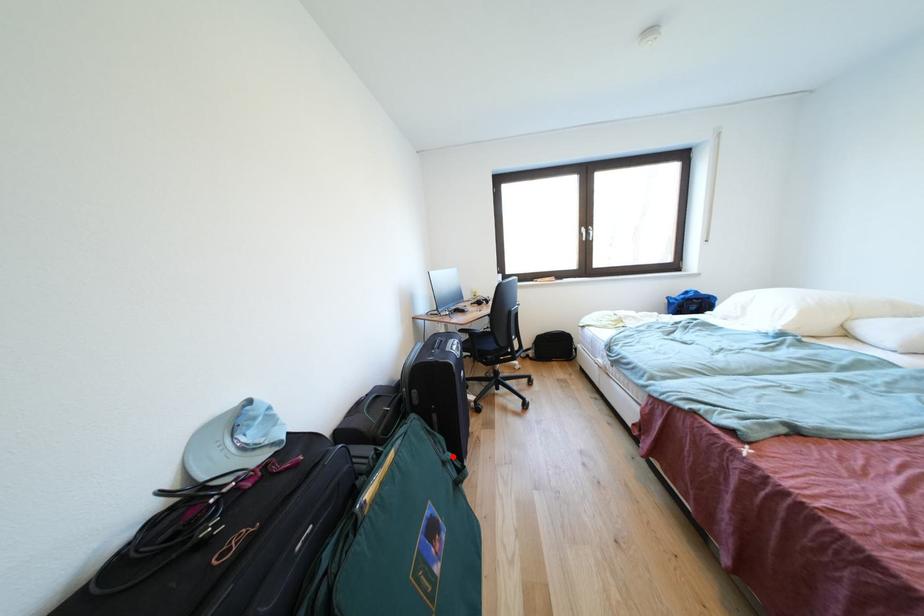
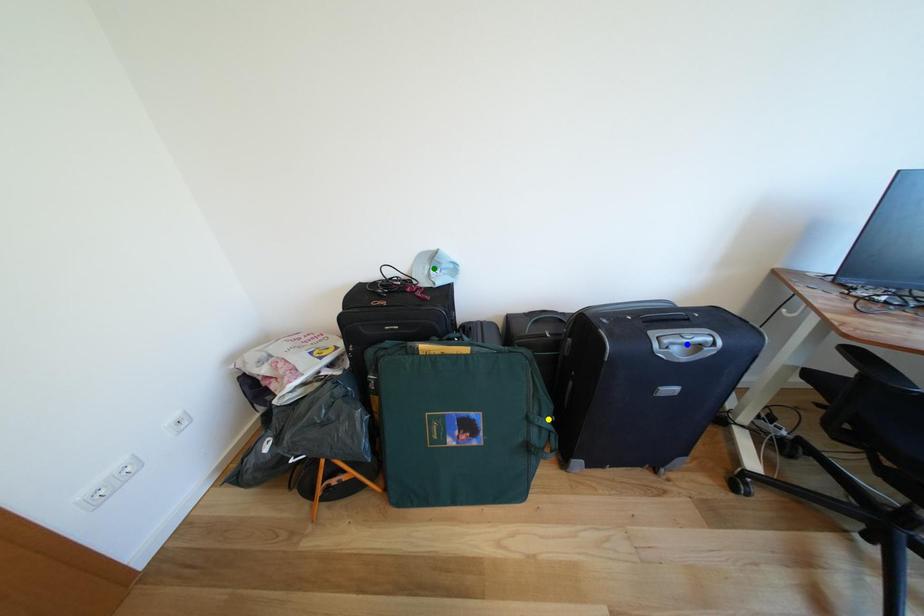
Question: I am providing you with two images of the same scene from different viewpoints. A red point is marked on the first image. You are given multiple points on the second image. In image 2, which mark is for the same physical point as the one in image 1?

Choices:
 (A) green point
 (B) blue point
 (C) yellow point

Answer: (C)